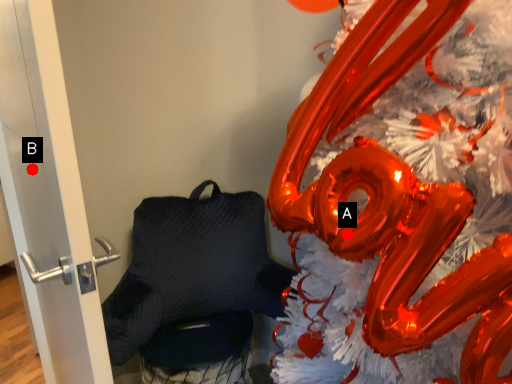
Question: Two points are circled on the image, labeled by A and B beside each circle. Among these points, which one is farthest from the camera?

Choices:
 (A) A is further
 (B) B is further

Answer: (B)